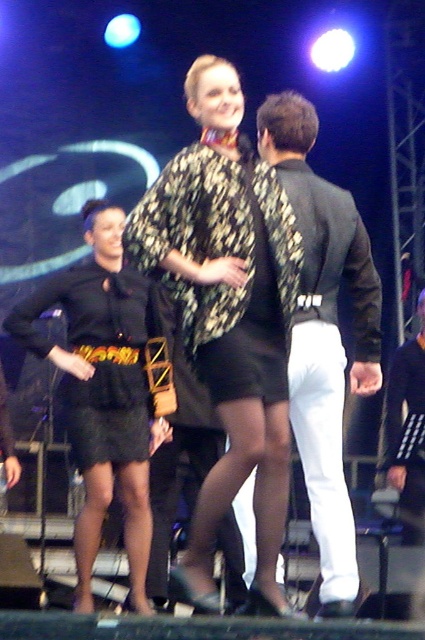
Can you confirm if printed fabric cape at center is positioned above shiny black jacket at center?

Yes.

Can you confirm if printed fabric cape at center is taller than shiny black jacket at center?

Yes, printed fabric cape at center is taller than shiny black jacket at center.

Find the location of a particular element. printed fabric cape at center is located at coordinates (227, 312).

Is point (319, 358) positioned before point (85, 332)?

Yes, point (319, 358) is in front of point (85, 332).

Can you confirm if shiny black jacket at center is smaller than black leather dress at left?

Indeed, shiny black jacket at center has a smaller size compared to black leather dress at left.

Image resolution: width=425 pixels, height=640 pixels. I want to click on shiny black jacket at center, so click(x=323, y=333).

Is printed fabric cape at center taller than black leather dress at left?

No, printed fabric cape at center is not taller than black leather dress at left.

Does point (278, 467) come farther from viewer compared to point (82, 387)?

No, it is in front of (82, 387).

Does point (246, 172) lie behind point (153, 436)?

No, it is not.

This screenshot has width=425, height=640. I want to click on printed fabric cape at center, so click(x=227, y=312).